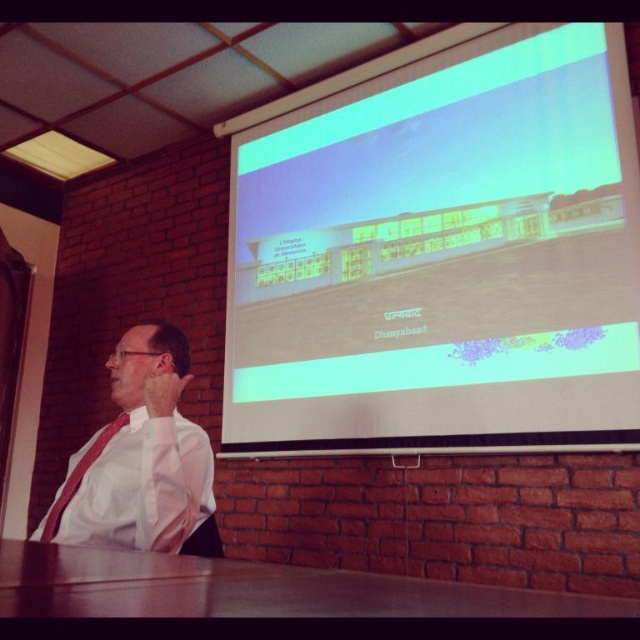
Does brown wooden table at lower center have a lesser width compared to white shirt at left?

No, brown wooden table at lower center is not thinner than white shirt at left.

Between brown wooden table at lower center and white shirt at left, which one has less height?

With less height is brown wooden table at lower center.

Is point (358, 573) farther from viewer compared to point (122, 534)?

No.

You are a GUI agent. You are given a task and a screenshot of the screen. Output one action in this format:
    pyautogui.click(x=<x>, y=<y>)
    Task: Click on the brown wooden table at lower center
    This screenshot has width=640, height=640.
    Given the screenshot: What is the action you would take?
    pyautogui.click(x=252, y=589)

Between white shirt at left and matte red tie at left, which one has more height?

With more height is white shirt at left.

Does white shirt at left have a greater width compared to matte red tie at left?

Yes.

This screenshot has height=640, width=640. In order to click on white shirt at left in this screenshot , I will do `click(141, 460)`.

You are a GUI agent. You are given a task and a screenshot of the screen. Output one action in this format:
    pyautogui.click(x=<x>, y=<y>)
    Task: Click on the white shirt at left
    
    Given the screenshot: What is the action you would take?
    pyautogui.click(x=141, y=460)

Who is positioned more to the left, brown wooden table at lower center or matte red tie at left?

From the viewer's perspective, matte red tie at left appears more on the left side.

Does brown wooden table at lower center appear on the left side of matte red tie at left?

No, brown wooden table at lower center is not to the left of matte red tie at left.

This screenshot has height=640, width=640. What are the coordinates of `brown wooden table at lower center` in the screenshot? It's located at (252, 589).